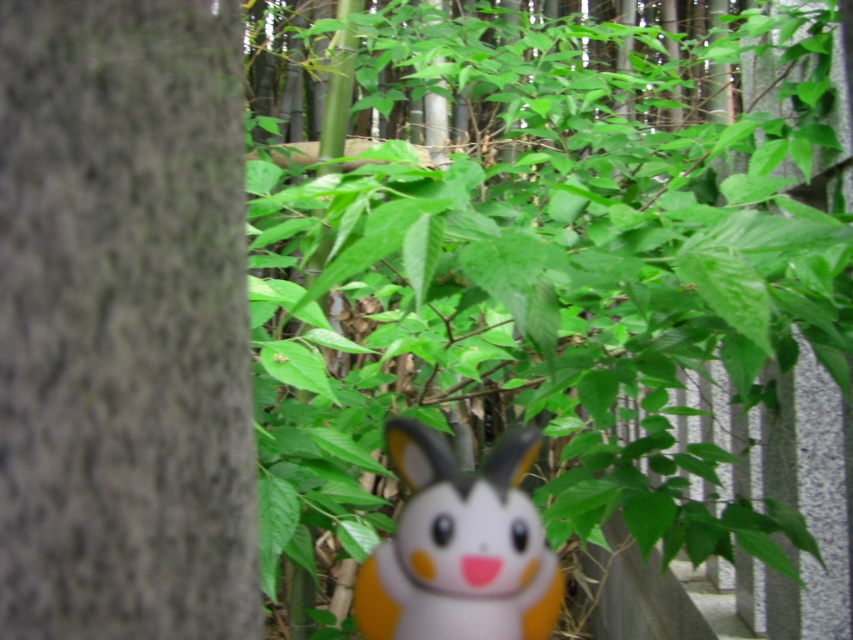
You are holding a ruler and want to measure the gray rough bark at center and the orange matte plush toy at center in the image. Which object would require a longer ruler to measure its height?

The orange matte plush toy at center is larger than the gray rough bark at center, so you would need a longer ruler to measure its height.

You are a child who wants to place the orange matte plush toy at center closer to the gray rough bark at center. How far apart are they currently?

The gray rough bark at center and orange matte plush toy at center are 3.42 feet apart from each other, so they are currently 3.42 feet apart.